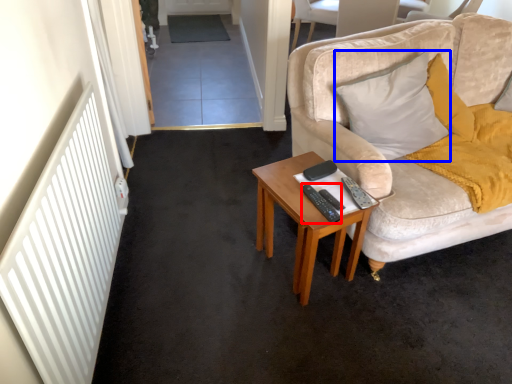
Question: Among these objects, which one is farthest to the camera, remote control (highlighted by a red box) or pillow (highlighted by a blue box)?

Choices:
 (A) remote control
 (B) pillow

Answer: (B)